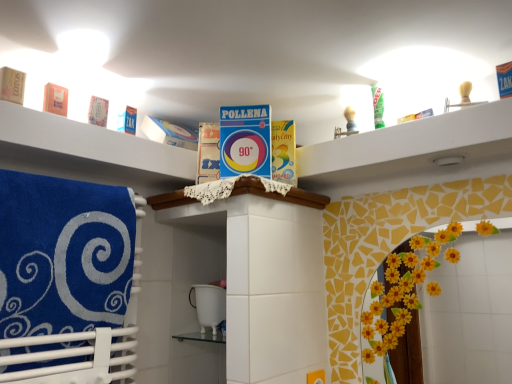
Question: Does blue soft towel at left lie in front of white cardboard box at upper center?

Choices:
 (A) yes
 (B) no

Answer: (A)

Question: Is blue soft towel at left taller than white cardboard box at upper center?

Choices:
 (A) no
 (B) yes

Answer: (B)

Question: Is blue soft towel at left at the right side of white cardboard box at upper center?

Choices:
 (A) yes
 (B) no

Answer: (B)

Question: Is blue soft towel at left bigger than white cardboard box at upper center?

Choices:
 (A) no
 (B) yes

Answer: (B)

Question: Is blue soft towel at left in contact with white cardboard box at upper center?

Choices:
 (A) yes
 (B) no

Answer: (B)

Question: Can you confirm if blue soft towel at left is positioned to the left of white cardboard box at upper center?

Choices:
 (A) no
 (B) yes

Answer: (B)

Question: Can we say white cardboard box at upper center lies outside blue soft towel at left?

Choices:
 (A) no
 (B) yes

Answer: (B)

Question: Is white cardboard box at upper center wider than blue soft towel at left?

Choices:
 (A) yes
 (B) no

Answer: (A)

Question: Does white cardboard box at upper center contain blue soft towel at left?

Choices:
 (A) no
 (B) yes

Answer: (A)

Question: From a real-world perspective, is white cardboard box at upper center over blue soft towel at left?

Choices:
 (A) yes
 (B) no

Answer: (A)

Question: Does white cardboard box at upper center appear on the left side of blue soft towel at left?

Choices:
 (A) no
 (B) yes

Answer: (A)

Question: Considering the relative sizes of white cardboard box at upper center and blue soft towel at left in the image provided, is white cardboard box at upper center bigger than blue soft towel at left?

Choices:
 (A) yes
 (B) no

Answer: (B)

Question: Is white cardboard box at upper center bigger or smaller than blue soft towel at left?

Choices:
 (A) small
 (B) big

Answer: (A)